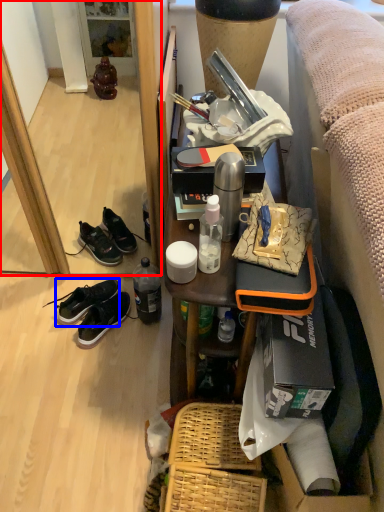
Question: Which object appears farthest to the camera in this image, mirror (highlighted by a red box) or shoe (highlighted by a blue box)?

Choices:
 (A) mirror
 (B) shoe

Answer: (B)